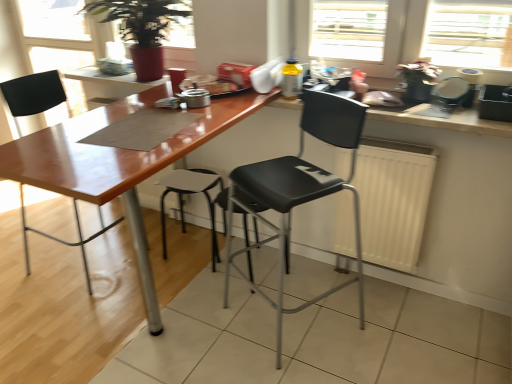
Question: Which direction should I rotate to look at matte wood table at center, which is the first table in top-to-bottom order?

Choices:
 (A) left
 (B) right

Answer: (A)

Question: Is matte wood table at center, which is the first table in top-to-bottom order, turned away from matte black stool at center?

Choices:
 (A) yes
 (B) no

Answer: (B)

Question: Considering the relative sizes of matte wood table at center, the 2th table positioned from the bottom, and matte black stool at center in the image provided, is matte wood table at center, the 2th table positioned from the bottom, bigger than matte black stool at center?

Choices:
 (A) yes
 (B) no

Answer: (B)

Question: From a real-world perspective, does matte wood table at center, which is the first table in top-to-bottom order, sit lower than matte black stool at center?

Choices:
 (A) no
 (B) yes

Answer: (A)

Question: Is matte wood table at center, which is the first table in top-to-bottom order, next to matte black stool at center and touching it?

Choices:
 (A) no
 (B) yes

Answer: (A)

Question: Considering the relative sizes of matte wood table at center, the 2th table positioned from the bottom, and matte black stool at center in the image provided, is matte wood table at center, the 2th table positioned from the bottom, smaller than matte black stool at center?

Choices:
 (A) yes
 (B) no

Answer: (A)

Question: Is matte wood table at center, the 2th table positioned from the bottom, positioned far away from matte black stool at center?

Choices:
 (A) yes
 (B) no

Answer: (B)

Question: Can you confirm if white matte radiator at center is thinner than matte wood table at center, the 2th table positioned from the bottom?

Choices:
 (A) yes
 (B) no

Answer: (A)

Question: From the image's perspective, is white matte radiator at center below matte wood table at center, the 2th table positioned from the bottom?

Choices:
 (A) no
 (B) yes

Answer: (B)

Question: Is white matte radiator at center to the right of matte wood table at center, the 2th table positioned from the bottom, from the viewer's perspective?

Choices:
 (A) yes
 (B) no

Answer: (A)

Question: Is white matte radiator at center positioned in front of matte wood table at center, the 2th table positioned from the bottom?

Choices:
 (A) yes
 (B) no

Answer: (A)

Question: From a real-world perspective, is white matte radiator at center located higher than matte wood table at center, the 2th table positioned from the bottom?

Choices:
 (A) yes
 (B) no

Answer: (B)

Question: Is white matte radiator at center bigger than matte wood table at center, which is the first table in top-to-bottom order?

Choices:
 (A) no
 (B) yes

Answer: (A)

Question: Does black plastic chair at center, which is the second chair from left to right, come behind wooden countertop at upper right?

Choices:
 (A) yes
 (B) no

Answer: (B)